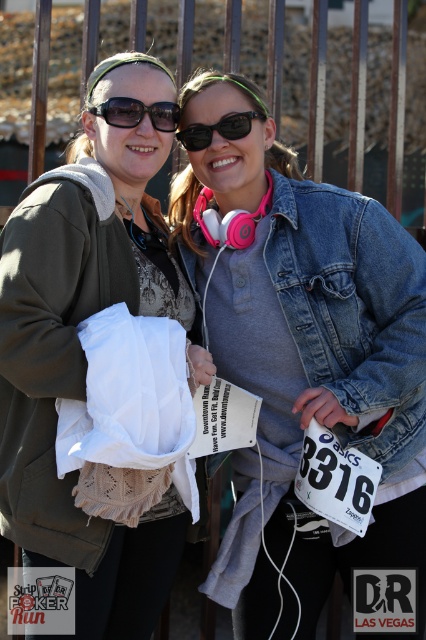
You are standing at the event location and want to take a photo of the point at coordinate point (x=385, y=44). The camera you have can focus on objects up to 50 meters away. Will the camera be able to capture the point clearly?

The point at coordinate point (x=385, y=44) is 53.83 meters away from the viewer, which exceeds the camera focus limit of 50 meters. Therefore, the camera will not be able to capture the point clearly.